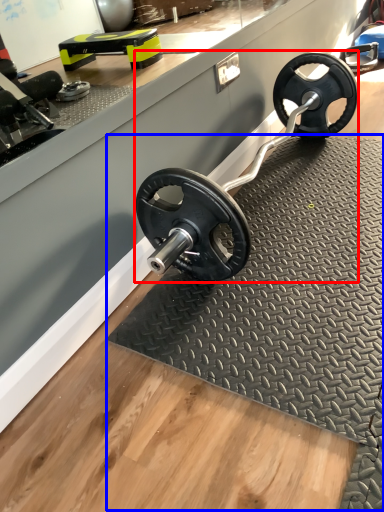
Question: Which object appears farthest to the camera in this image, sport equipment (highlighted by a red box) or mat (highlighted by a blue box)?

Choices:
 (A) sport equipment
 (B) mat

Answer: (A)